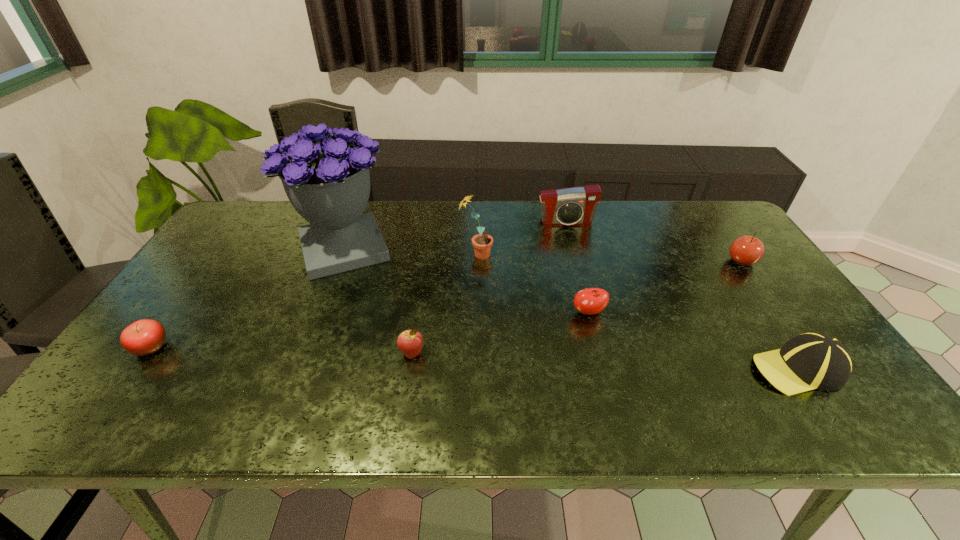
Where is `vacant space situated on the back of the leftmost apple`? The height and width of the screenshot is (540, 960). vacant space situated on the back of the leftmost apple is located at coordinates (191, 293).

Where is `bouquet situated at the far edge`? This screenshot has height=540, width=960. bouquet situated at the far edge is located at coordinates coord(328,184).

Identify the location of camera that is at the far edge. This screenshot has width=960, height=540. (577, 205).

This screenshot has height=540, width=960. Find the location of `object that is positioned at the near edge`. object that is positioned at the near edge is located at coordinates (809, 361).

This screenshot has height=540, width=960. In order to click on object positioned at the left edge in this screenshot , I will do `click(143, 337)`.

Find the location of a particular element. The height and width of the screenshot is (540, 960). apple that is at the right edge is located at coordinates (746, 250).

Where is `baseball cap at the right edge`? baseball cap at the right edge is located at coordinates (809, 361).

The width and height of the screenshot is (960, 540). Identify the location of object that is at the near right corner. (809, 361).

You are a GUI agent. You are given a task and a screenshot of the screen. Output one action in this format:
    pyautogui.click(x=<x>, y=<y>)
    Task: Click on the vacant space at the far edge of the desktop
    Image resolution: width=960 pixels, height=540 pixels.
    Given the screenshot: What is the action you would take?
    pyautogui.click(x=621, y=208)

Locate an element on the screen. Image resolution: width=960 pixels, height=540 pixels. vacant space at the near edge of the desktop is located at coordinates (489, 403).